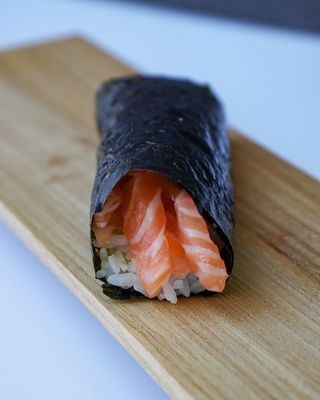
This screenshot has width=320, height=400. I want to click on wooden board, so click(x=283, y=257).